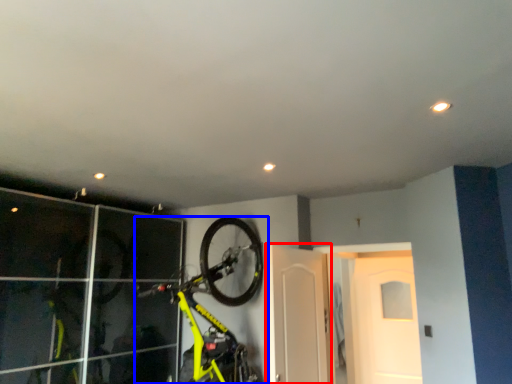
Question: Which point is closer to the camera, door (highlighted by a red box) or bicycle (highlighted by a blue box)?

Choices:
 (A) door
 (B) bicycle

Answer: (B)